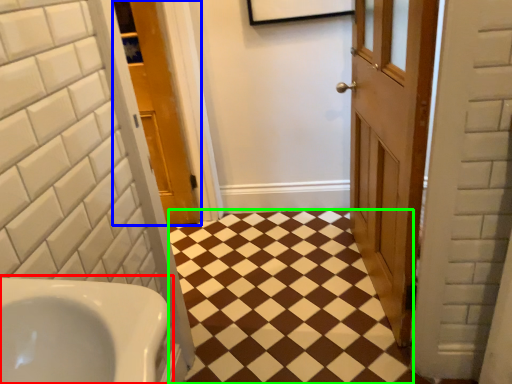
Question: Estimate the real-world distances between objects in this image. Which object is closer to sink (highlighted by a red box), door (highlighted by a blue box) or square (highlighted by a green box)?

Choices:
 (A) door
 (B) square

Answer: (B)